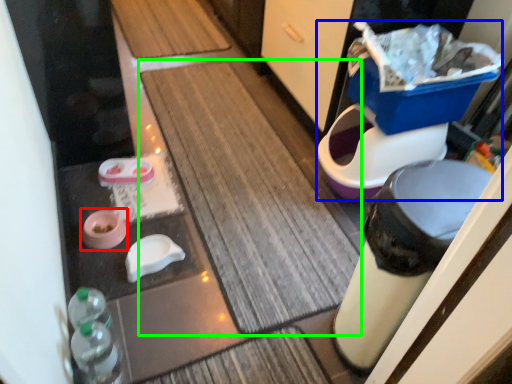
Question: Which is nearer to the potty (highlighted by a red box)? potty (highlighted by a blue box) or bath mat (highlighted by a green box).

Choices:
 (A) potty
 (B) bath mat

Answer: (B)